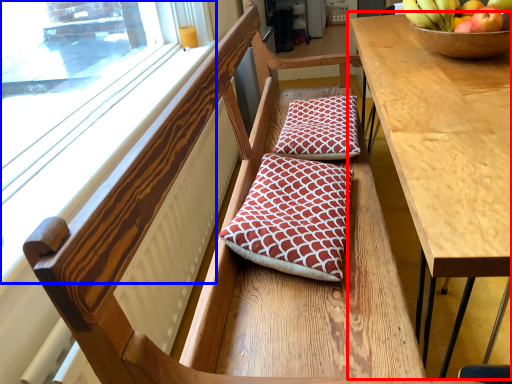
Question: Which point is closer to the camera, table (highlighted by a red box) or window (highlighted by a blue box)?

Choices:
 (A) table
 (B) window

Answer: (A)